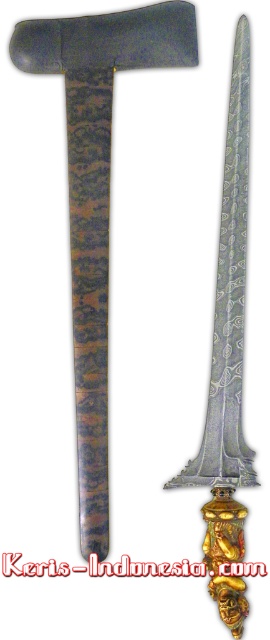
Between polished silver sword at center and silver polished metal sword at center, which one appears on the right side from the viewer's perspective?

From the viewer's perspective, silver polished metal sword at center appears more on the right side.

Is point (98, 131) positioned in front of point (224, 291)?

Yes, it is.

Who is more distant from viewer, [95,388] or [198,480]?

The point [95,388] is more distant.

The image size is (270, 640). I want to click on polished silver sword at center, so click(x=96, y=196).